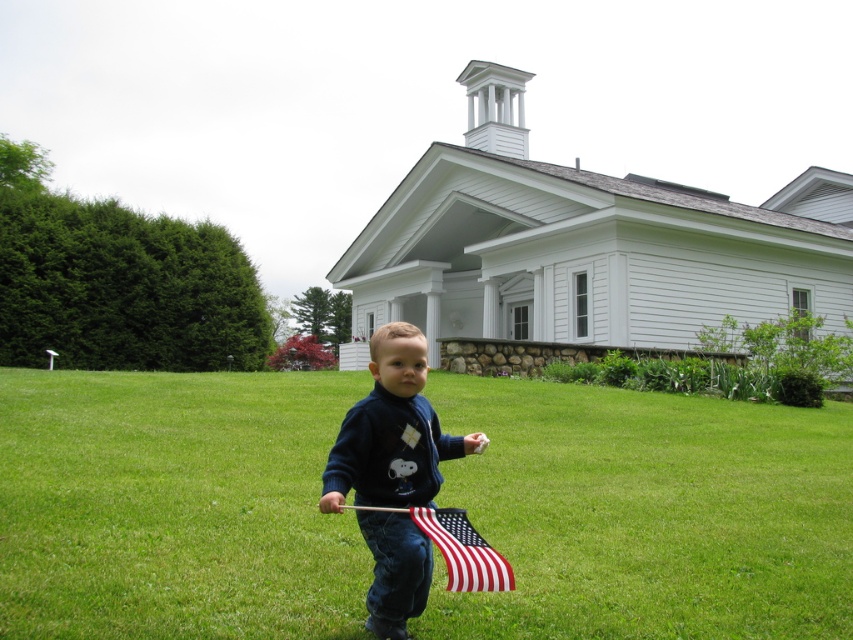
You are standing in front of the house and want to walk from point (463,604) to point (485,582). Which direction should you face to move towards the second point?

You should face away from the house because point (463,604) is closer to you than point (485,582), so moving away from the house would take you towards the second point.